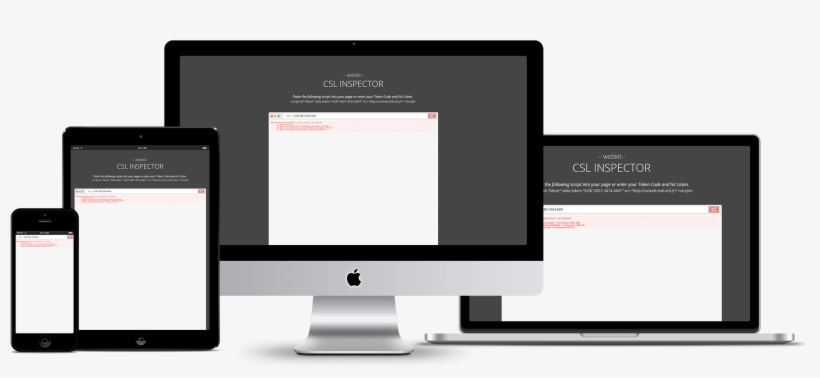
The height and width of the screenshot is (378, 820). In order to click on laptop in this screenshot , I will do `click(676, 171)`.